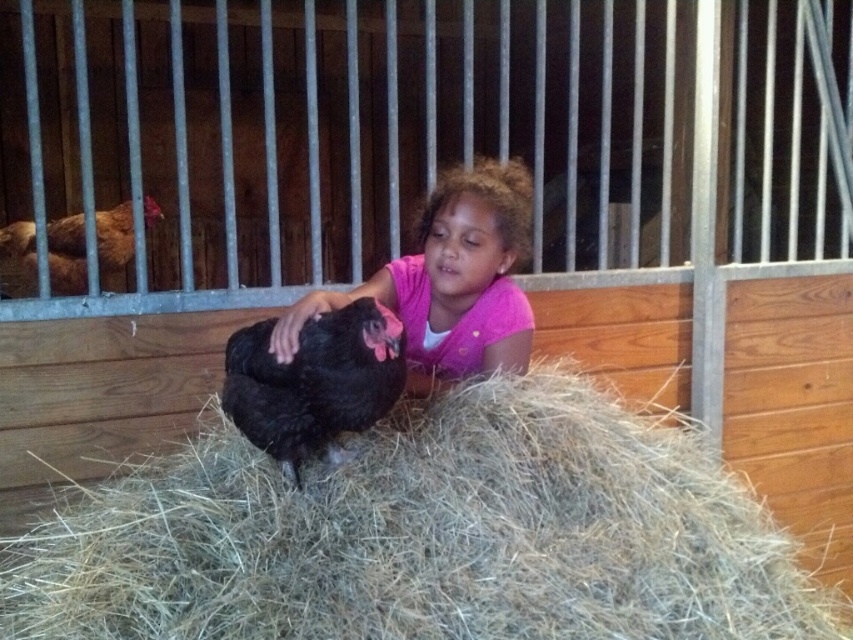
You are a farmer checking the barn. You see the light brown straw at center and the black feathered chicken at center. Which object is wider?

The light brown straw at center is wider than the black feathered chicken at center.

Where is the light brown straw at center located in the image?

The light brown straw at center is located at point (426, 536).

You are a farmer who needs to move the black feathered chicken at center to a different pen. Considering the size of the light brown straw at center, will you need to adjust the space where you place the chicken?

The light brown straw at center is larger than the black feathered chicken at center. Therefore, the space occupied by the light brown straw at center is sufficient to accommodate the black feathered chicken at center without needing adjustment.